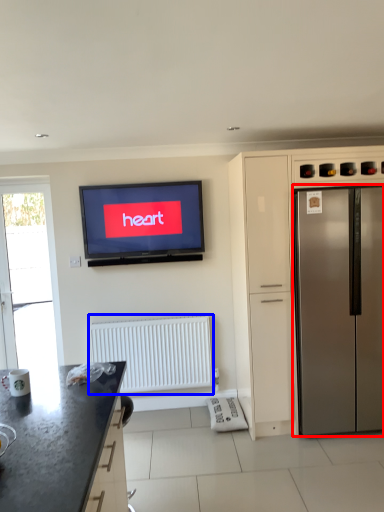
Question: Among these objects, which one is farthest to the camera, refrigerator (highlighted by a red box) or radiator (highlighted by a blue box)?

Choices:
 (A) refrigerator
 (B) radiator

Answer: (B)